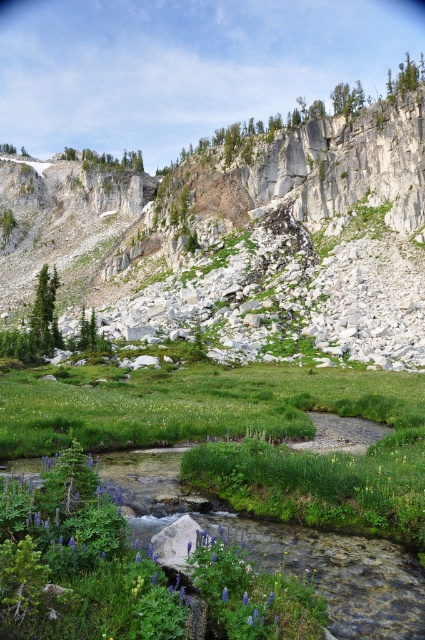
Can you confirm if white rocky mountain at upper center is taller than purple matte flower at center?

Yes.

Can you confirm if white rocky mountain at upper center is shorter than purple matte flower at center?

No, white rocky mountain at upper center is not shorter than purple matte flower at center.

You are a GUI agent. You are given a task and a screenshot of the screen. Output one action in this format:
    pyautogui.click(x=<x>, y=<y>)
    Task: Click on the white rocky mountain at upper center
    Image resolution: width=425 pixels, height=640 pixels.
    Given the screenshot: What is the action you would take?
    pyautogui.click(x=251, y=236)